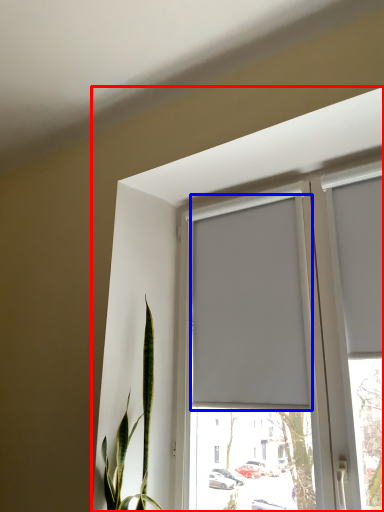
Question: Which object appears farthest to the camera in this image, window (highlighted by a red box) or curtain (highlighted by a blue box)?

Choices:
 (A) window
 (B) curtain

Answer: (B)